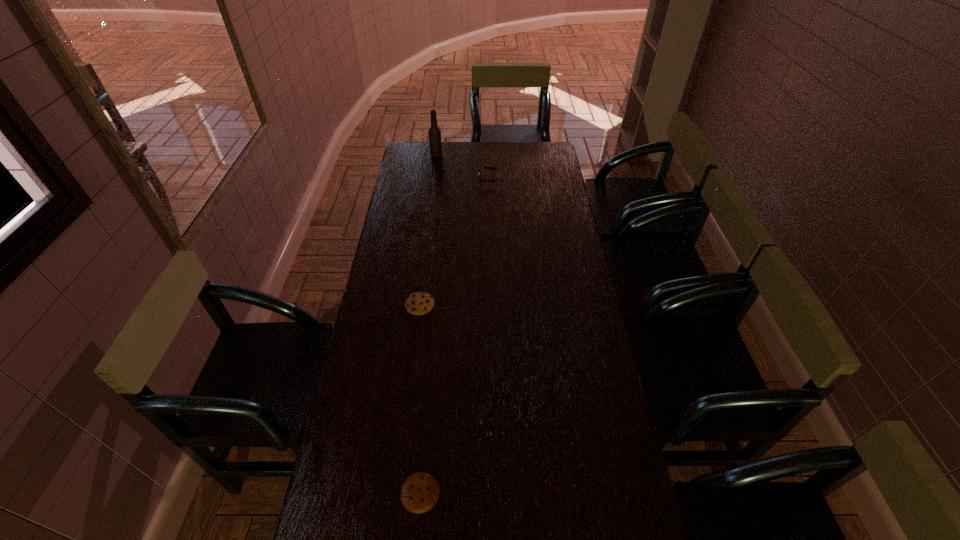
Identify the location of vacant region located on the front-facing side of the third nearest object. The width and height of the screenshot is (960, 540). (462, 179).

Identify the location of vacant space located on the front-facing side of the third nearest object. (464, 179).

You are a GUI agent. You are given a task and a screenshot of the screen. Output one action in this format:
    pyautogui.click(x=<x>, y=<y>)
    Task: Click on the vacant region located 0.120m on the right of the taller cookie
    This screenshot has width=960, height=540.
    Given the screenshot: What is the action you would take?
    pyautogui.click(x=467, y=305)

Image resolution: width=960 pixels, height=540 pixels. What are the coordinates of `vacant region located 0.330m on the back of the nearest object` in the screenshot? It's located at (431, 369).

This screenshot has width=960, height=540. I want to click on object at the far edge, so click(x=434, y=132).

Where is `beer bottle situated at the left edge`? This screenshot has height=540, width=960. beer bottle situated at the left edge is located at coordinates [434, 132].

I want to click on cookie that is positioned at the left edge, so click(x=419, y=303).

You are a GUI agent. You are given a task and a screenshot of the screen. Output one action in this format:
    pyautogui.click(x=<x>, y=<y>)
    Task: Click on the object present at the far left corner
    The height and width of the screenshot is (540, 960).
    Given the screenshot: What is the action you would take?
    pyautogui.click(x=434, y=132)

Identify the location of free point at the far edge. This screenshot has height=540, width=960. pyautogui.click(x=515, y=159).

This screenshot has width=960, height=540. I want to click on free spot at the left edge of the desktop, so click(416, 172).